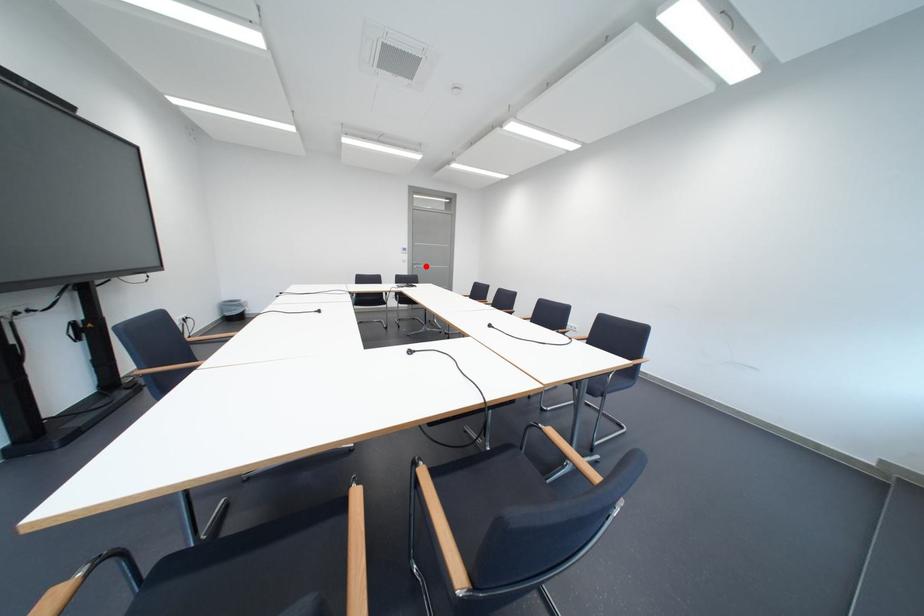
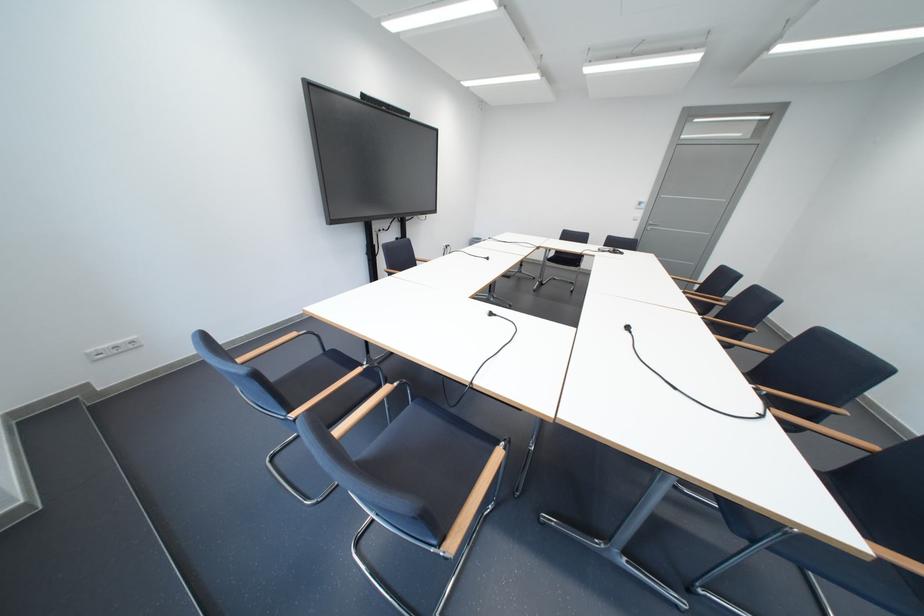
Find the pixel in the second image that matches the highlighted location in the first image.

(660, 227)